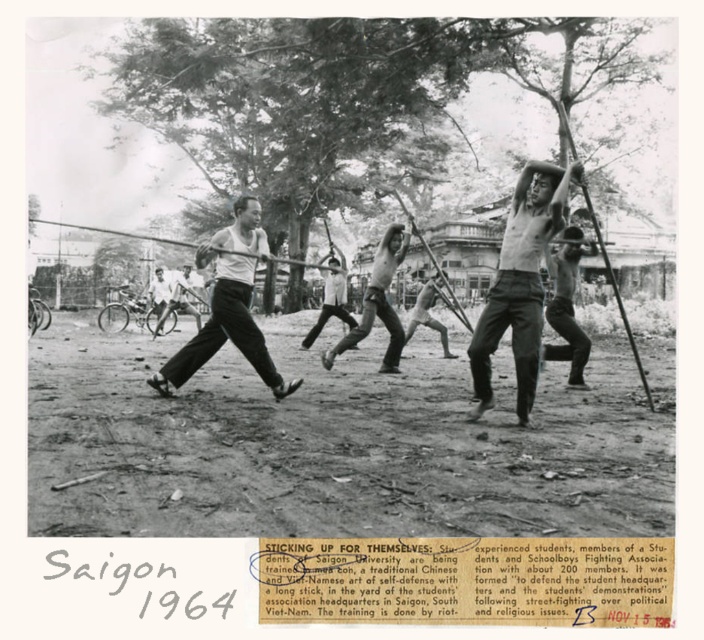
Between white cotton tank top at center and smooth skin man at center, which one appears on the right side from the viewer's perspective?

From the viewer's perspective, smooth skin man at center appears more on the right side.

This screenshot has height=640, width=704. In order to click on white cotton tank top at center in this screenshot , I will do `click(227, 305)`.

Who is lower down, shiny black pants at center or light gray cotton shirt at center?

Positioned lower is light gray cotton shirt at center.

Locate an element on the screen. The image size is (704, 640). shiny black pants at center is located at coordinates (520, 284).

Which is behind, point (508, 266) or point (203, 253)?

Point (203, 253)

Between point (513, 324) and point (194, 259), which one is positioned in front?

Positioned in front is point (513, 324).

Where is `shiny black pants at center`? This screenshot has width=704, height=640. shiny black pants at center is located at coordinates (520, 284).